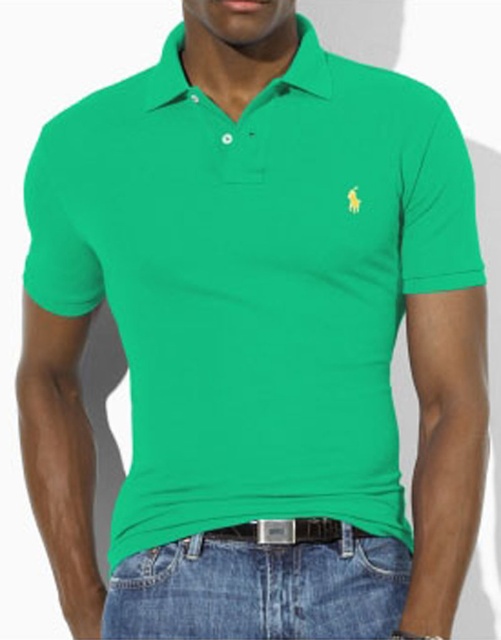
Question: Which of the following is the closest to the observer?

Choices:
 (A) denim jeans at lower center
 (B) jeans pocket at lower center

Answer: (A)

Question: Is denim jeans at lower center bigger than jeans pocket at lower center?

Choices:
 (A) yes
 (B) no

Answer: (A)

Question: Where is denim jeans at lower center located in relation to jeans pocket at lower center in the image?

Choices:
 (A) right
 (B) left

Answer: (A)

Question: Can you confirm if denim jeans at lower center is thinner than jeans pocket at lower center?

Choices:
 (A) no
 (B) yes

Answer: (A)

Question: Which point is farther to the camera?

Choices:
 (A) jeans pocket at lower center
 (B) denim jeans at lower center

Answer: (A)